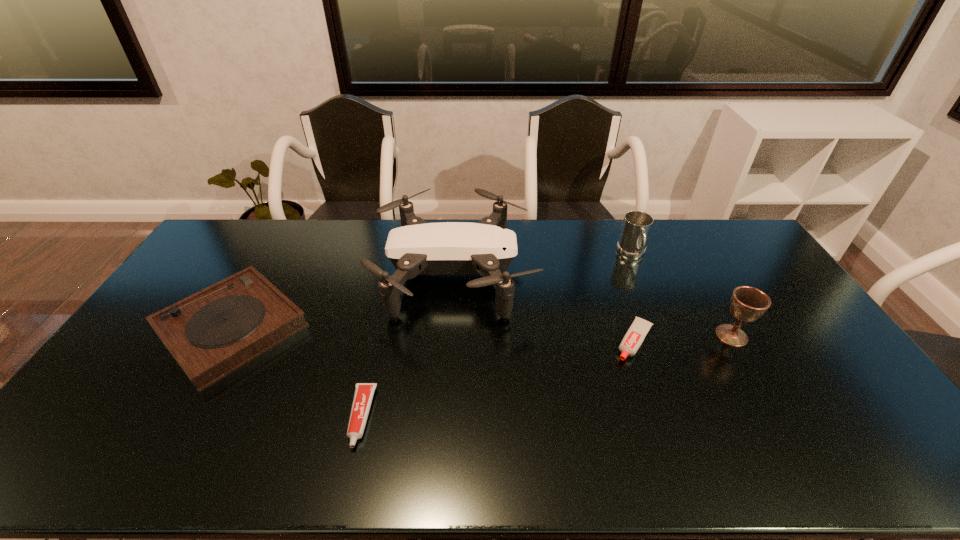
Locate an element on the screen. The image size is (960, 540). free space between the drone and the rightmost object is located at coordinates pyautogui.click(x=593, y=305).

The image size is (960, 540). What are the coordinates of `blank region between the phonograph record and the farther toothpaste` in the screenshot? It's located at (433, 334).

Where is `free area in between the mug and the drone`? Image resolution: width=960 pixels, height=540 pixels. free area in between the mug and the drone is located at coordinates (543, 264).

Choose which object is the fourth nearest neighbor to the mug. Please provide its 2D coordinates. Your answer should be formatted as a tuple, i.e. [(x, y)], where the tuple contains the x and y coordinates of a point satisfying the conditions above.

[(364, 392)]

At what (x,y) coordinates should I click in order to perform the action: click on object that is the fourth closest to the tallest object. Please return your answer as a coordinate pair (x, y). The image size is (960, 540). Looking at the image, I should click on (636, 228).

Where is `free space that satisfies the following two spatial constraints: 1. on the back side of the right toothpaste; 2. on the camera side of the drone`? Image resolution: width=960 pixels, height=540 pixels. free space that satisfies the following two spatial constraints: 1. on the back side of the right toothpaste; 2. on the camera side of the drone is located at coordinates (612, 274).

Identify the location of free region that satisfies the following two spatial constraints: 1. on the side of the chalice with the handle; 2. on the right side of the mug. (665, 335).